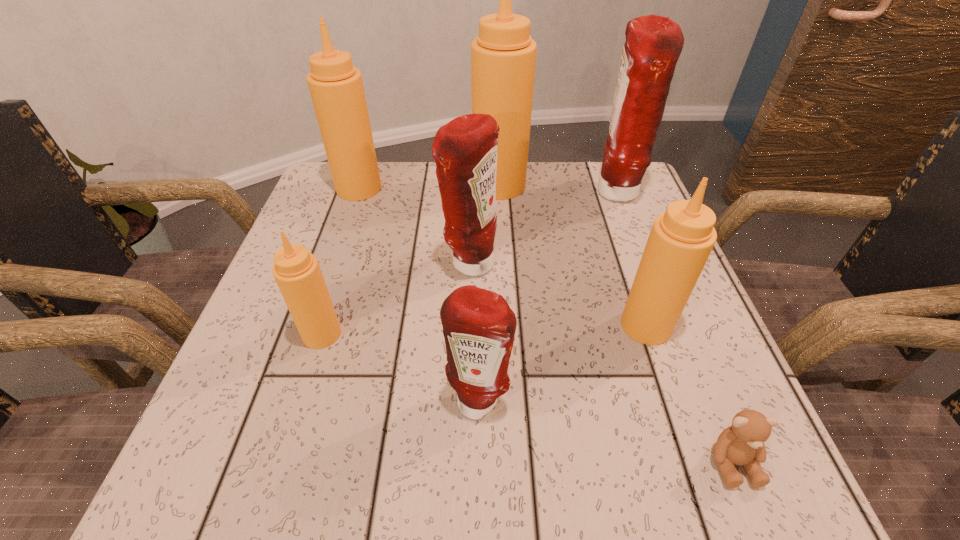
Identify the location of the biggest tan condiment. (503, 56).

The image size is (960, 540). In order to click on the tallest condiment in this screenshot , I will do `click(503, 56)`.

In order to click on the third smallest tan condiment in this screenshot , I will do `click(336, 87)`.

Locate an element on the screen. This screenshot has width=960, height=540. the farthest red condiment is located at coordinates (653, 45).

Image resolution: width=960 pixels, height=540 pixels. I want to click on the rightmost red condiment, so click(x=653, y=45).

Image resolution: width=960 pixels, height=540 pixels. Identify the location of the second biggest red condiment. (465, 150).

Identify the location of the fourth farthest object. This screenshot has width=960, height=540. (465, 150).

The width and height of the screenshot is (960, 540). I want to click on the second smallest tan condiment, so click(x=681, y=239).

Identify the location of the smallest tan condiment. The image size is (960, 540). (297, 272).

Where is `the nearest condiment`? Image resolution: width=960 pixels, height=540 pixels. the nearest condiment is located at coordinates (479, 327).